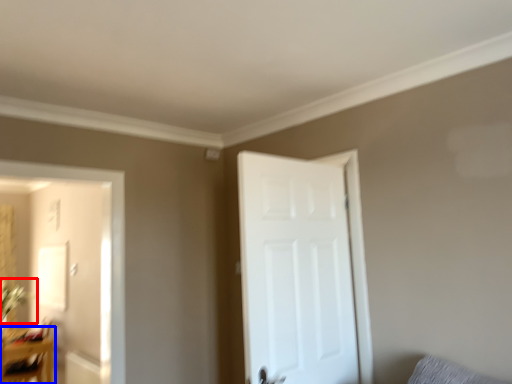
Question: Which object is further to the camera taking this photo, plant (highlighted by a red box) or table (highlighted by a blue box)?

Choices:
 (A) plant
 (B) table

Answer: (A)